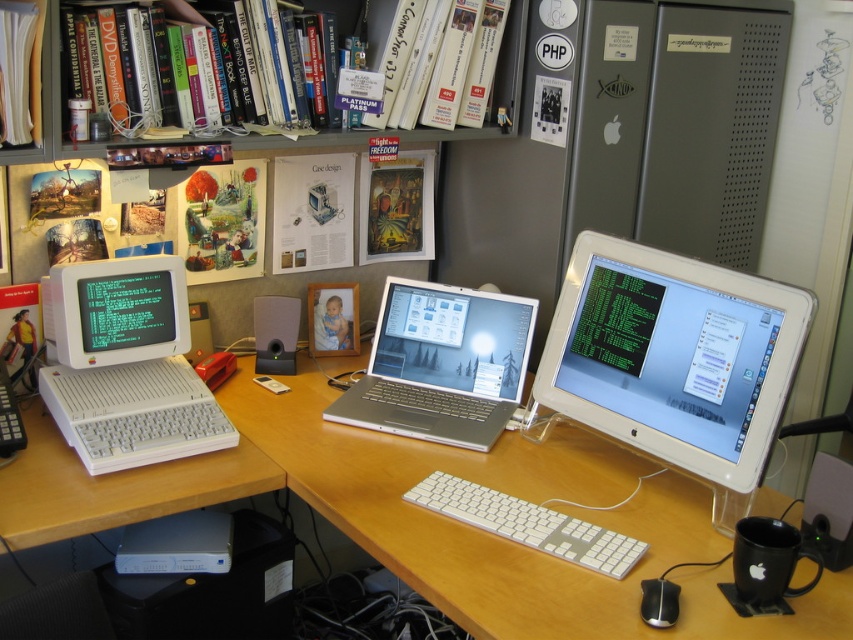
Does silver metallic laptop at center have a greater height compared to white plastic books at upper left?

No, silver metallic laptop at center is not taller than white plastic books at upper left.

Locate an element on the screen. The image size is (853, 640). silver metallic laptop at center is located at coordinates (440, 364).

Who is more forward, (15,520) or (647,349)?

Positioned in front is point (15,520).

Measure the distance between wooden at center and camera.

The distance of wooden at center from camera is 3.78 feet.

I want to click on wooden at center, so click(x=426, y=516).

Find the location of a particular element. This screenshot has height=640, width=853. wooden at center is located at coordinates (426, 516).

Is wooden at center thinner than white plastic computer at left?

No.

Describe the element at coordinates (426, 516) in the screenshot. I see `wooden at center` at that location.

This screenshot has height=640, width=853. What do you see at coordinates (426, 516) in the screenshot?
I see `wooden at center` at bounding box center [426, 516].

At what (x,y) coordinates should I click in order to perform the action: click on wooden at center. Please return your answer as a coordinate pair (x, y). The width and height of the screenshot is (853, 640). Looking at the image, I should click on (426, 516).